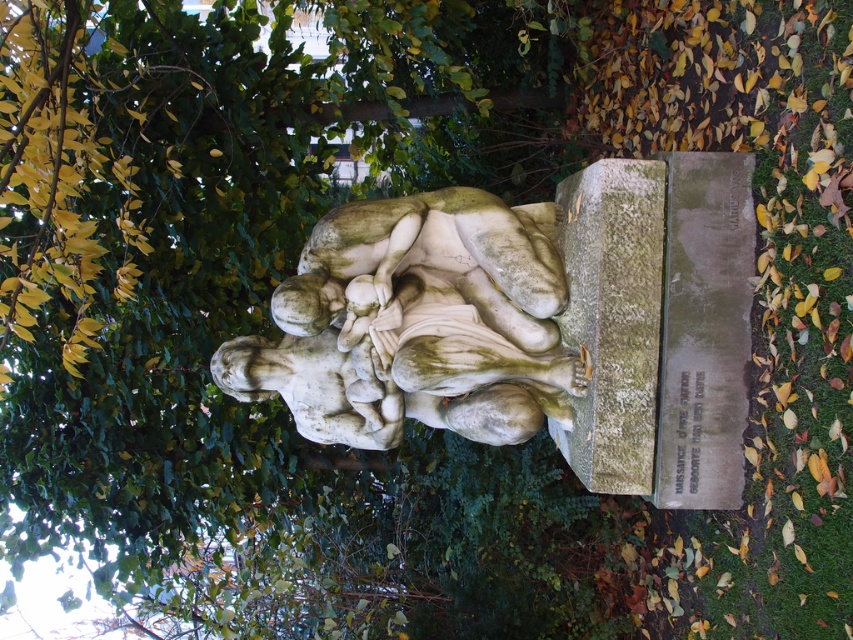
Is white marble statue at center shorter than green mossy stone at center?

Yes, white marble statue at center is shorter than green mossy stone at center.

Who is positioned more to the right, white marble statue at center or green mossy stone at center?

green mossy stone at center is more to the right.

Does point (426, 410) come farther from viewer compared to point (642, 435)?

Yes, point (426, 410) is behind point (642, 435).

Where is `white marble statue at center`? The image size is (853, 640). white marble statue at center is located at coordinates (416, 323).